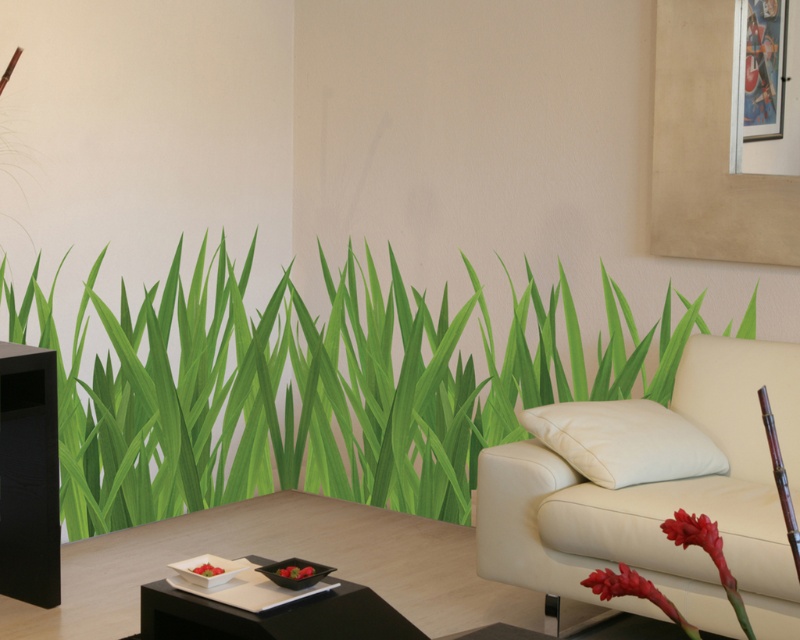
You are a delivery person trying to place a large rectangular package that is 1.2 meters long between the white leather couch at upper right and the black glossy side table at lower center. Can the package fit in the space between them?

The distance between the white leather couch at upper right and the black glossy side table at lower center is 1.16 meters. Since the package is 1.2 meters long, it is slightly longer than the available space, so the package cannot fit between them.

Consider the image. You are standing in the living room and want to place a small table between the green matte grass at center and the white leather couch at upper right. Based on their positions, which side of the couch should the table be placed on?

The green matte grass at center is to the left of the white leather couch at upper right, so the table should be placed on the left side of the couch.